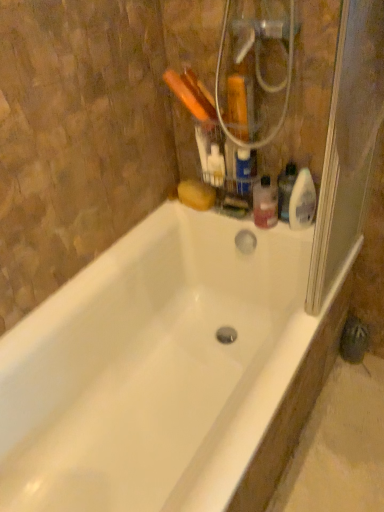
Question: From the image's perspective, is transparent plastic screen door at right positioned above or below translucent plastic bottle at upper right?

Choices:
 (A) above
 (B) below

Answer: (A)

Question: Is transparent plastic screen door at right taller or shorter than translucent plastic bottle at upper right?

Choices:
 (A) short
 (B) tall

Answer: (B)

Question: Which of these objects is positioned farthest from the white plastic toothbrushes at upper center, the 1th cleaning product in the left-to-right sequence?

Choices:
 (A) white glossy bathtub at center
 (B) translucent plastic spray bottle at upper right, the 1th cleaning product positioned from the right
 (C) transparent plastic screen door at right
 (D) translucent plastic bottle at upper right, the second cleaning product from the right
 (E) translucent plastic bottle at upper right

Answer: (A)

Question: Which object is positioned closest to the white plastic toothbrushes at upper center, the 1th cleaning product in the left-to-right sequence?

Choices:
 (A) translucent plastic spray bottle at upper right, the 3th cleaning product in the left-to-right sequence
 (B) translucent plastic bottle at upper right, the second cleaning product from the right
 (C) translucent plastic bottle at upper right
 (D) transparent plastic screen door at right
 (E) white glossy bathtub at center

Answer: (C)